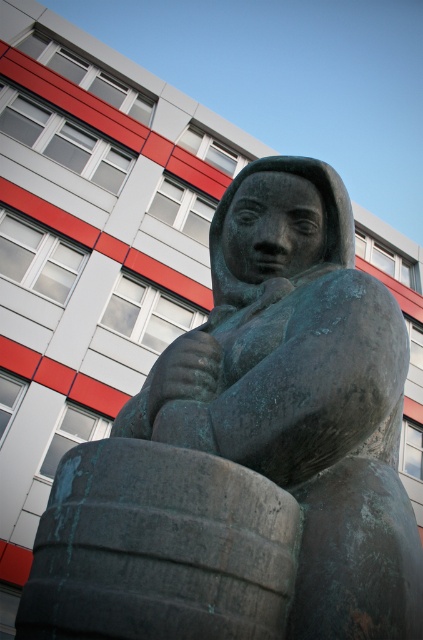
Looking at this image, can you confirm if green patina stone statue at center is bigger than greenish-brown rubber tire at lower left?

Yes.

Where is `green patina stone statue at center`? This screenshot has width=423, height=640. green patina stone statue at center is located at coordinates (249, 448).

I want to click on green patina stone statue at center, so click(249, 448).